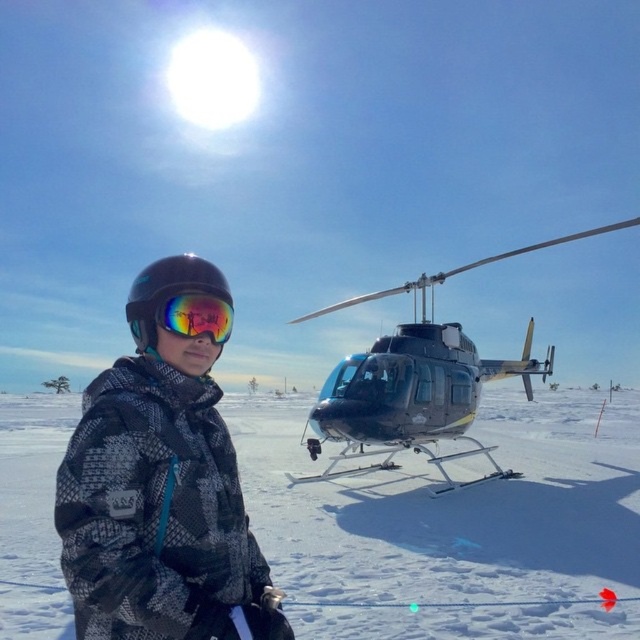
Question: Estimate the real-world distances between objects in this image. Which object is closer to the camouflage jacket at center?

Choices:
 (A) white snow at center
 (B) metallic silver helicopter at center

Answer: (B)

Question: Does metallic silver helicopter at center appear on the left side of reflective mirrored goggles at center?

Choices:
 (A) yes
 (B) no

Answer: (B)

Question: Does white snow at center lie behind metallic silver helicopter at center?

Choices:
 (A) no
 (B) yes

Answer: (A)

Question: Which object appears farthest from the camera in this image?

Choices:
 (A) white snow at center
 (B) rimless reflective helmet at center

Answer: (A)

Question: Which is farther from the white snow at center?

Choices:
 (A) rimless reflective helmet at center
 (B) camouflage jacket at center

Answer: (A)

Question: Is white snow at center positioned behind camouflage jacket at center?

Choices:
 (A) no
 (B) yes

Answer: (B)